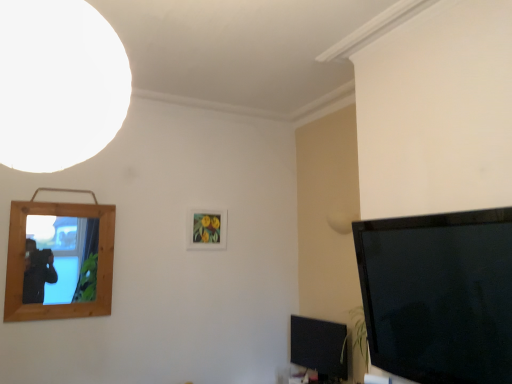
Question: Can you confirm if white matte light at upper left is thinner than matte wooden picture frame at center, the second picture frame viewed from the front?

Choices:
 (A) yes
 (B) no

Answer: (B)

Question: Can you confirm if white matte light at upper left is smaller than matte wooden picture frame at center, the second picture frame from the left?

Choices:
 (A) yes
 (B) no

Answer: (B)

Question: Is white matte light at upper left further to the viewer compared to matte wooden picture frame at center, the second picture frame viewed from the front?

Choices:
 (A) yes
 (B) no

Answer: (B)

Question: Is white matte light at upper left not inside matte wooden picture frame at center, the second picture frame viewed from the front?

Choices:
 (A) no
 (B) yes

Answer: (B)

Question: Is white matte light at upper left facing towards matte wooden picture frame at center, which is the first picture frame in right-to-left order?

Choices:
 (A) no
 (B) yes

Answer: (A)

Question: From a real-world perspective, is white matte light at upper left positioned over matte wooden picture frame at center, the second picture frame viewed from the front, based on gravity?

Choices:
 (A) yes
 (B) no

Answer: (A)

Question: From the image's perspective, is wooden mirror at left, acting as the first picture frame starting from the front, under white matte light at upper left?

Choices:
 (A) no
 (B) yes

Answer: (B)

Question: Is there a large distance between wooden mirror at left, the first picture frame in the left-to-right sequence, and white matte light at upper left?

Choices:
 (A) yes
 (B) no

Answer: (A)

Question: Is wooden mirror at left, placed as the 2th picture frame when sorted from right to left, outside of white matte light at upper left?

Choices:
 (A) no
 (B) yes

Answer: (B)

Question: Can you confirm if wooden mirror at left, placed as the 2th picture frame when sorted from right to left, is positioned to the right of white matte light at upper left?

Choices:
 (A) yes
 (B) no

Answer: (B)

Question: Does wooden mirror at left, placed as the 2th picture frame when sorted from right to left, appear on the left side of white matte light at upper left?

Choices:
 (A) yes
 (B) no

Answer: (A)

Question: Does wooden mirror at left, the first picture frame in the left-to-right sequence, have a greater height compared to white matte light at upper left?

Choices:
 (A) no
 (B) yes

Answer: (B)

Question: From the image's perspective, does white matte light at upper left appear higher than wooden mirror at left, the first picture frame in the left-to-right sequence?

Choices:
 (A) no
 (B) yes

Answer: (B)